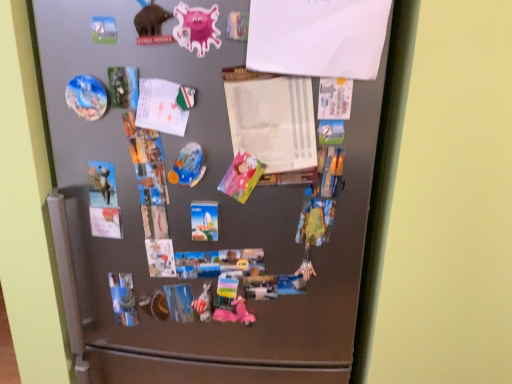
Question: In which direction should I rotate to look at shiny metallic plate at center, the second art from the left?

Choices:
 (A) right
 (B) left

Answer: (B)

Question: Is white paper at upper center, positioned as the 1th paper in top-to-bottom order, facing towards metallic silver statue at center, marked as the third art in a left-to-right arrangement?

Choices:
 (A) no
 (B) yes

Answer: (A)

Question: Is metallic silver statue at center, marked as the 1th art in a bottom-to-top arrangement, completely or partially inside white paper at upper center, arranged as the second paper when viewed from the back?

Choices:
 (A) no
 (B) yes

Answer: (A)

Question: Are white paper at upper center, the first paper positioned from the front, and metallic silver statue at center, which appears as the second art when viewed from the right, beside each other?

Choices:
 (A) no
 (B) yes

Answer: (A)

Question: Is the depth of white paper at upper center, arranged as the second paper when viewed from the back, less than that of metallic silver statue at center, the 4th art when ordered from top to bottom?

Choices:
 (A) no
 (B) yes

Answer: (B)

Question: Does white paper at upper center, acting as the 2th paper starting from the bottom, have a smaller size compared to metallic silver statue at center, the 4th art when ordered from top to bottom?

Choices:
 (A) yes
 (B) no

Answer: (B)

Question: Is there a large distance between white paper at upper center, the first paper positioned from the front, and metallic silver statue at center, which appears as the second art when viewed from the right?

Choices:
 (A) yes
 (B) no

Answer: (B)

Question: From a real-world perspective, is white paper at center, the 2th paper when ordered from top to bottom, positioned over white paper at upper center, positioned as the 1th paper in top-to-bottom order, based on gravity?

Choices:
 (A) no
 (B) yes

Answer: (A)

Question: Is white paper at center, the 1th paper from the back, taller than white paper at upper center, the first paper positioned from the front?

Choices:
 (A) no
 (B) yes

Answer: (A)

Question: Is white paper at center, the first paper ordered from the bottom, looking in the opposite direction of white paper at upper center, positioned as the 1th paper in top-to-bottom order?

Choices:
 (A) yes
 (B) no

Answer: (B)

Question: Does white paper at center, the 2th paper when ordered from top to bottom, come in front of white paper at upper center, positioned as the 1th paper in top-to-bottom order?

Choices:
 (A) no
 (B) yes

Answer: (A)

Question: Is white paper at center, the first paper ordered from the bottom, directly adjacent to white paper at upper center, the first paper positioned from the front?

Choices:
 (A) no
 (B) yes

Answer: (B)

Question: From the image's perspective, is white paper at center, the 1th paper from the back, on white paper at upper center, positioned as the 1th paper in top-to-bottom order?

Choices:
 (A) no
 (B) yes

Answer: (A)

Question: Does white paper at center, the first paper ordered from the bottom, come behind matte plastic magnet at upper left, the 4th art positioned from the bottom?

Choices:
 (A) no
 (B) yes

Answer: (A)